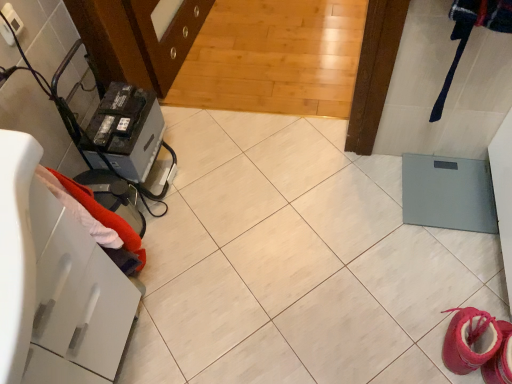
Question: Can you confirm if white glossy drawer at left is wider than black plastic battery at left?

Choices:
 (A) yes
 (B) no

Answer: (A)

Question: Is white glossy drawer at left to the left of black plastic battery at left from the viewer's perspective?

Choices:
 (A) yes
 (B) no

Answer: (A)

Question: From a real-world perspective, is white glossy drawer at left under black plastic battery at left?

Choices:
 (A) no
 (B) yes

Answer: (A)

Question: Is white glossy drawer at left placed right next to black plastic battery at left?

Choices:
 (A) yes
 (B) no

Answer: (B)

Question: From a real-world perspective, does white glossy drawer at left stand above black plastic battery at left?

Choices:
 (A) yes
 (B) no

Answer: (A)

Question: Considering the positions of red fabric towel at left and pink suede booties at lower right in the image, is red fabric towel at left wider or thinner than pink suede booties at lower right?

Choices:
 (A) thin
 (B) wide

Answer: (A)

Question: From the image's perspective, is red fabric towel at left positioned above or below pink suede booties at lower right?

Choices:
 (A) above
 (B) below

Answer: (A)

Question: Is red fabric towel at left in front of or behind pink suede booties at lower right in the image?

Choices:
 (A) behind
 (B) front

Answer: (B)

Question: Is point (94, 211) closer or farther from the camera than point (449, 309)?

Choices:
 (A) closer
 (B) farther

Answer: (A)

Question: From a real-world perspective, is black plastic battery at left above or below white glossy drawer at left?

Choices:
 (A) above
 (B) below

Answer: (B)

Question: Considering the relative positions of black plastic battery at left and white glossy drawer at left in the image provided, is black plastic battery at left to the left or to the right of white glossy drawer at left?

Choices:
 (A) left
 (B) right

Answer: (B)

Question: From their relative heights in the image, would you say black plastic battery at left is taller or shorter than white glossy drawer at left?

Choices:
 (A) tall
 (B) short

Answer: (B)

Question: Considering the positions of black plastic battery at left and white glossy drawer at left in the image, is black plastic battery at left bigger or smaller than white glossy drawer at left?

Choices:
 (A) big
 (B) small

Answer: (B)

Question: Does point (64, 233) appear closer or farther from the camera than point (458, 359)?

Choices:
 (A) farther
 (B) closer

Answer: (B)

Question: From a real-world perspective, is white glossy drawer at left positioned above or below pink suede booties at lower right?

Choices:
 (A) above
 (B) below

Answer: (A)